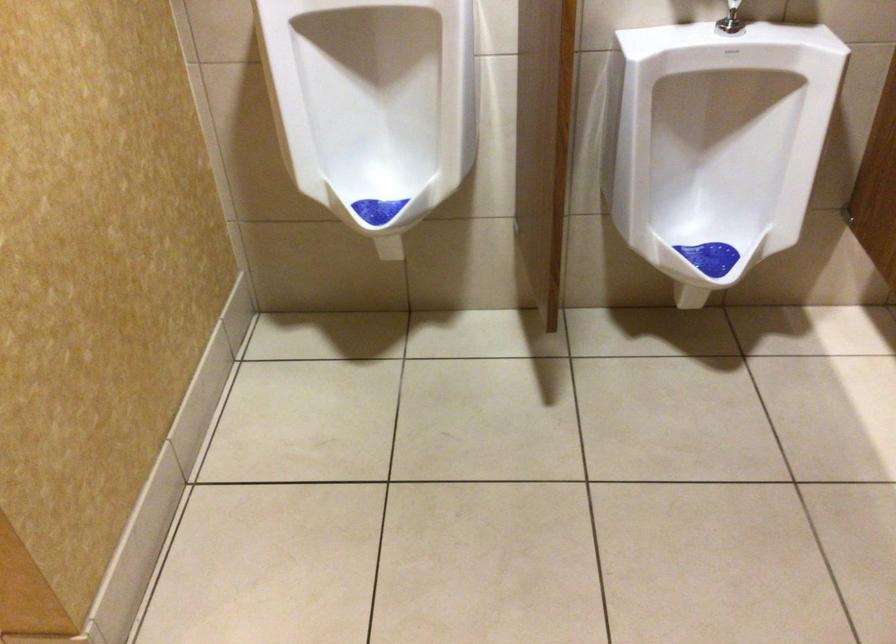
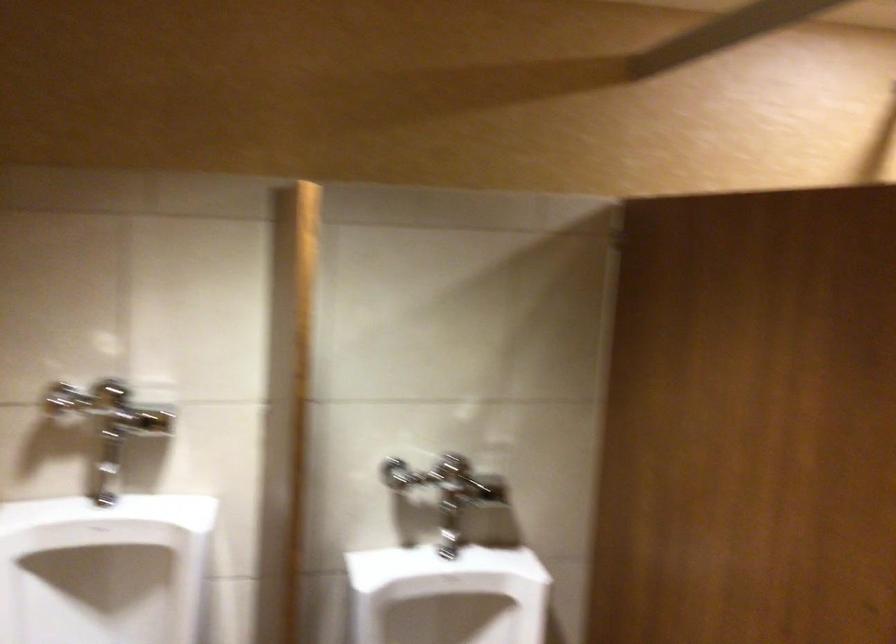
First-person continuous shooting, in which direction is the camera rotating?

The camera's rotation is toward right-up.